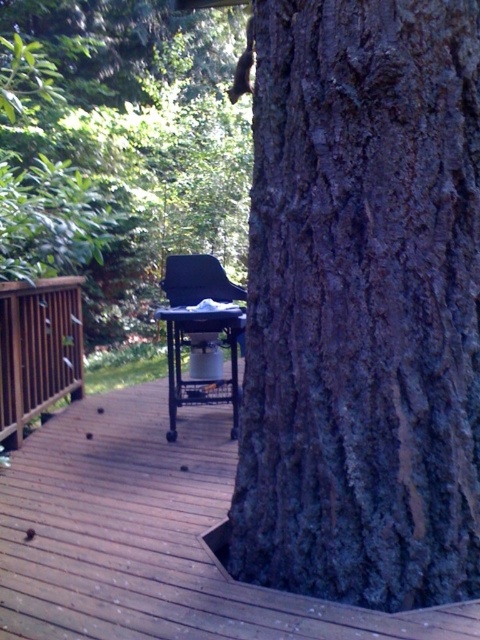
You are planning to place a large potted plant between the dark gray bark at center and the brown wooden rail at left. Considering their sizes, which object should the plant be closer to?

The dark gray bark at center is bigger than the brown wooden rail at left, so the plant should be placed closer to the dark gray bark at center to maintain balance.

You are standing in the backyard and want to place a small potted plant between the dark gray bark at center and the brown wooden rail at left. Based on their positions, which object should the plant be closer to?

The dark gray bark at center is closer to the viewer than the brown wooden rail at left, so the plant should be placed closer to the brown wooden rail at left to maintain equal distance from both objects.

You are planning to place a large dining table on the brown wooden deck at center and the brown wooden rail at left. Which area can accommodate the table better?

The brown wooden deck at center is bigger than the brown wooden rail at left, so it can accommodate the large dining table better.